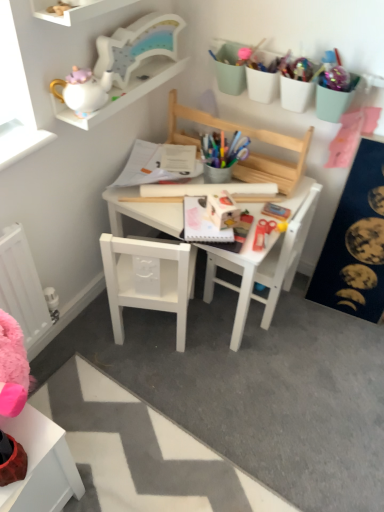
You are a GUI agent. You are given a task and a screenshot of the screen. Output one action in this format:
    pyautogui.click(x=<x>, y=<y>)
    Task: Click on the space that is in front of white wooden table at center
    This screenshot has height=512, width=384.
    Given the screenshot: What is the action you would take?
    pyautogui.click(x=202, y=398)